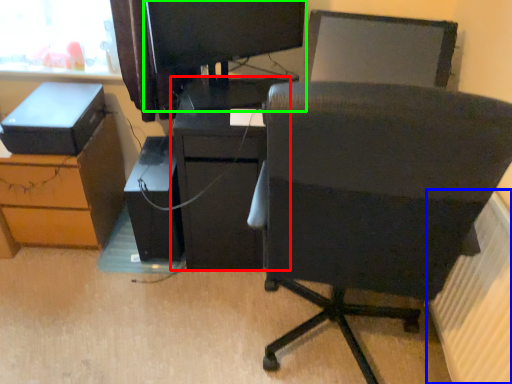
Question: Based on their relative distances, which object is farther from furniture (highlighted by a red box)? Choose from radiator (highlighted by a blue box) and desktop computer (highlighted by a green box).

Choices:
 (A) radiator
 (B) desktop computer

Answer: (A)